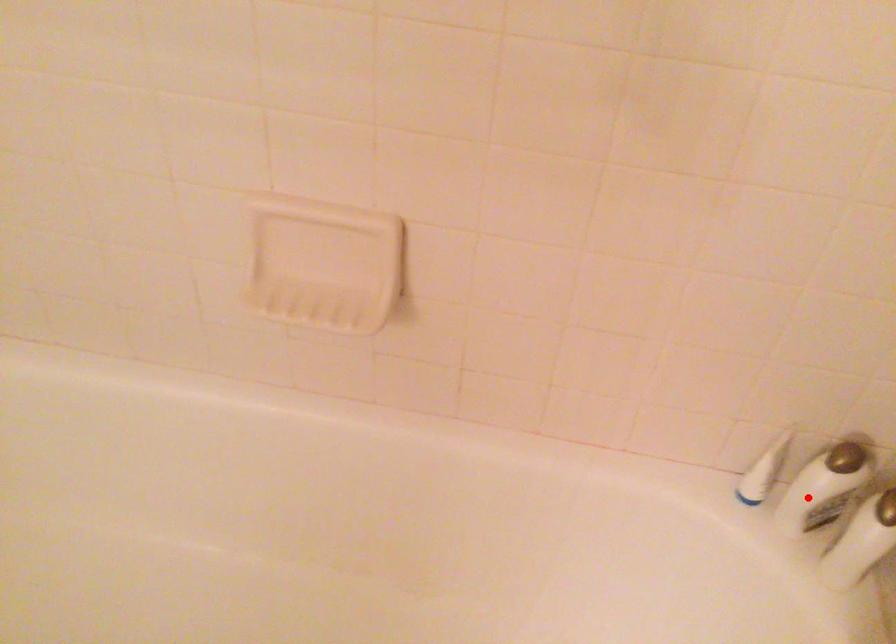
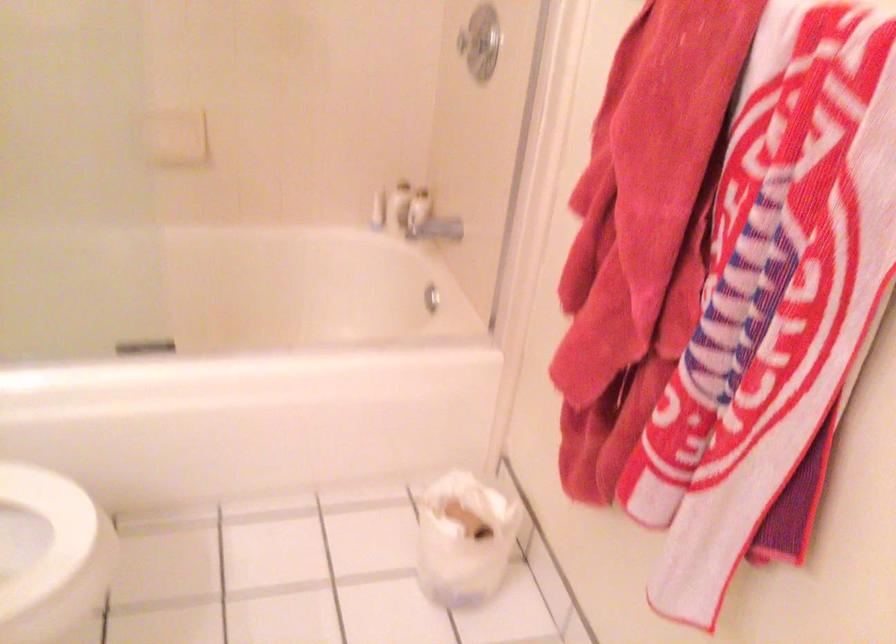
Question: I am providing you with two images of the same scene from different viewpoints. In image1, a red point is highlighted. Considering the same 3D point in image2, which of the following is correct?

Choices:
 (A) It is closer
 (B) It is farther

Answer: (B)